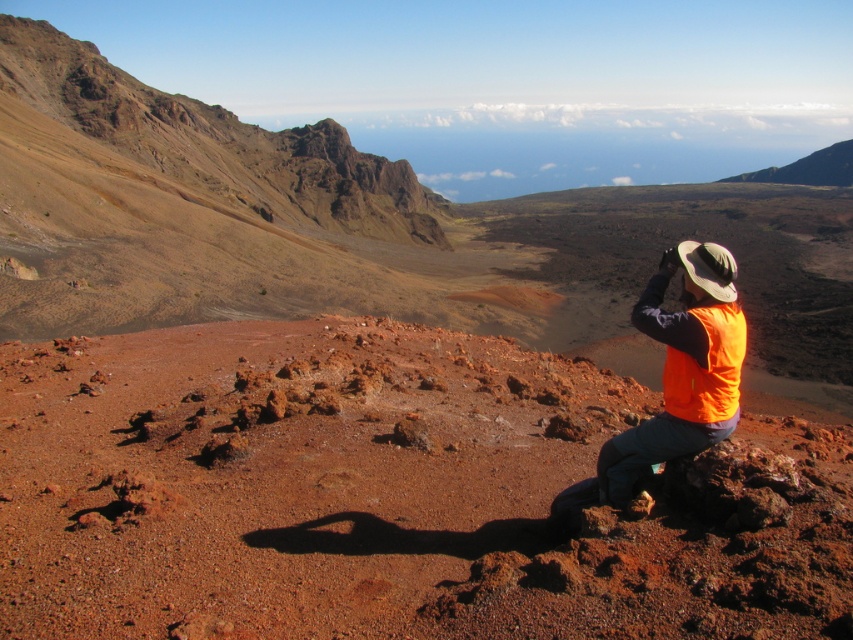
Who is more forward, (84, 433) or (677, 337)?

Positioned in front is point (677, 337).

The image size is (853, 640). In order to click on dull reddish-brown dirt at center in this screenshot , I will do `click(389, 493)`.

Identify the location of dull reddish-brown dirt at center. (389, 493).